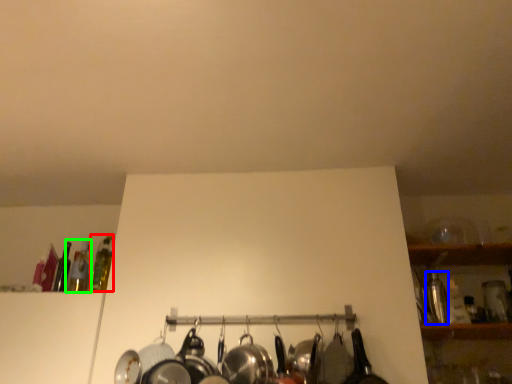
Question: Considering the real-world distances, which object is farthest from bottle (highlighted by a red box)? bottle (highlighted by a blue box) or bottle (highlighted by a green box)?

Choices:
 (A) bottle
 (B) bottle

Answer: (A)